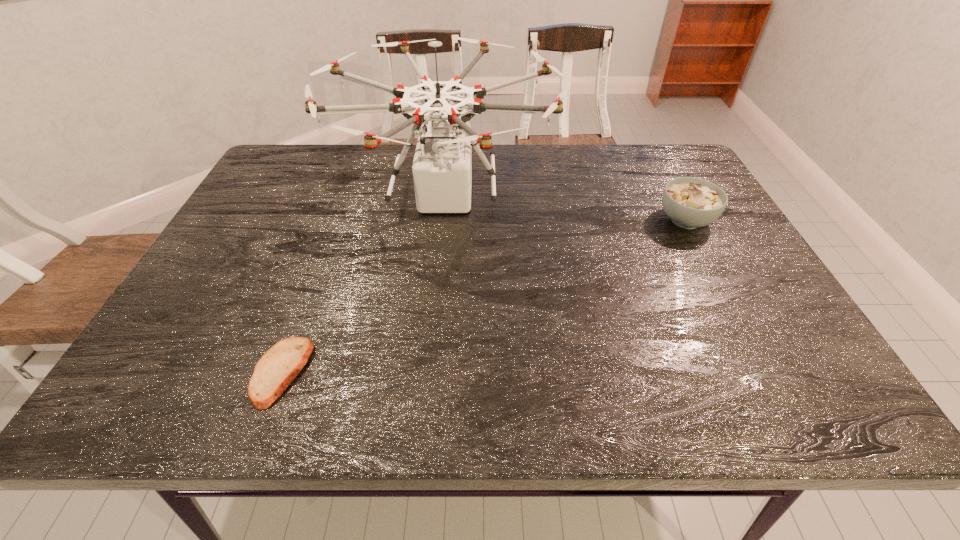
You are a GUI agent. You are given a task and a screenshot of the screen. Output one action in this format:
    pyautogui.click(x=<x>, y=<y>)
    Task: Click on the object at the right edge
    
    Given the screenshot: What is the action you would take?
    pyautogui.click(x=689, y=202)

The image size is (960, 540). I want to click on free space at the far edge, so click(x=372, y=156).

Locate an element on the screen. The height and width of the screenshot is (540, 960). vacant space at the near edge of the desktop is located at coordinates (726, 388).

In the image, there is a desktop. What are the coordinates of `vacant space at the left edge` in the screenshot? It's located at (210, 364).

I want to click on free region at the right edge of the desktop, so click(696, 282).

Image resolution: width=960 pixels, height=540 pixels. I want to click on vacant space at the far left corner of the desktop, so click(x=284, y=153).

Identify the location of vacant space at the far right corner. The width and height of the screenshot is (960, 540). (687, 167).

Locate an element on the screen. empty space that is in between the soup bowl and the drone is located at coordinates (565, 208).

This screenshot has height=540, width=960. I want to click on free point between the rightmost object and the pita bread, so click(484, 296).

In order to click on free space between the tallest object and the pita bread in this screenshot , I will do `click(364, 285)`.